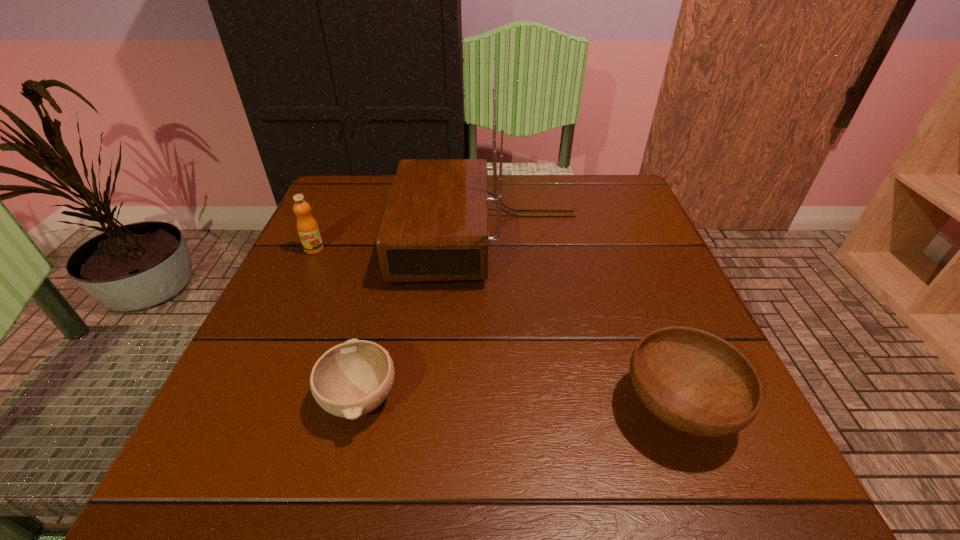
Image resolution: width=960 pixels, height=540 pixels. Identify the location of vacant space at the near edge. (377, 454).

In the image, there is a desktop. Identify the location of vacant region at the left edge. (300, 431).

I want to click on vacant point at the right edge, so click(613, 273).

I want to click on free space at the far left corner of the desktop, so click(x=342, y=200).

Where is `vacant region at the near left corner`? This screenshot has height=540, width=960. vacant region at the near left corner is located at coordinates (194, 494).

The image size is (960, 540). In the image, there is a desktop. Find the location of `vacant region at the far right corner`. vacant region at the far right corner is located at coordinates (639, 206).

You are a GUI agent. You are given a task and a screenshot of the screen. Output one action in this format:
    pyautogui.click(x=<x>, y=<y>)
    Task: Click on the vacant area at the near right corner
    Image resolution: width=960 pixels, height=540 pixels.
    Given the screenshot: What is the action you would take?
    pyautogui.click(x=656, y=448)

Locate an element on the screen. The height and width of the screenshot is (540, 960). free space between the left bowl and the leftmost object is located at coordinates (337, 323).

Identify the location of vacant area that lies between the shortest object and the orange juice. Image resolution: width=960 pixels, height=540 pixels. (337, 323).

The image size is (960, 540). In order to click on free space between the shorter bowl and the leftmost object in this screenshot , I will do `click(337, 323)`.